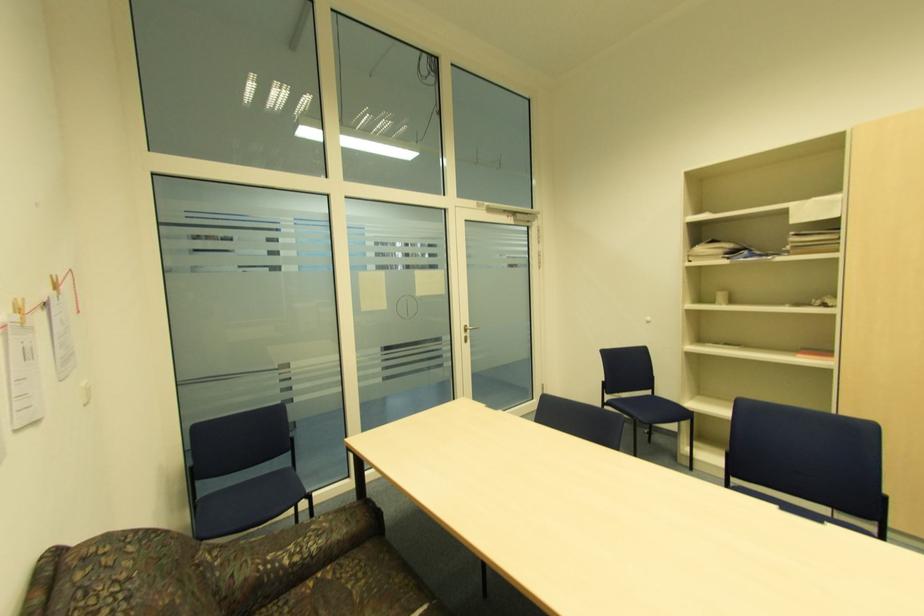
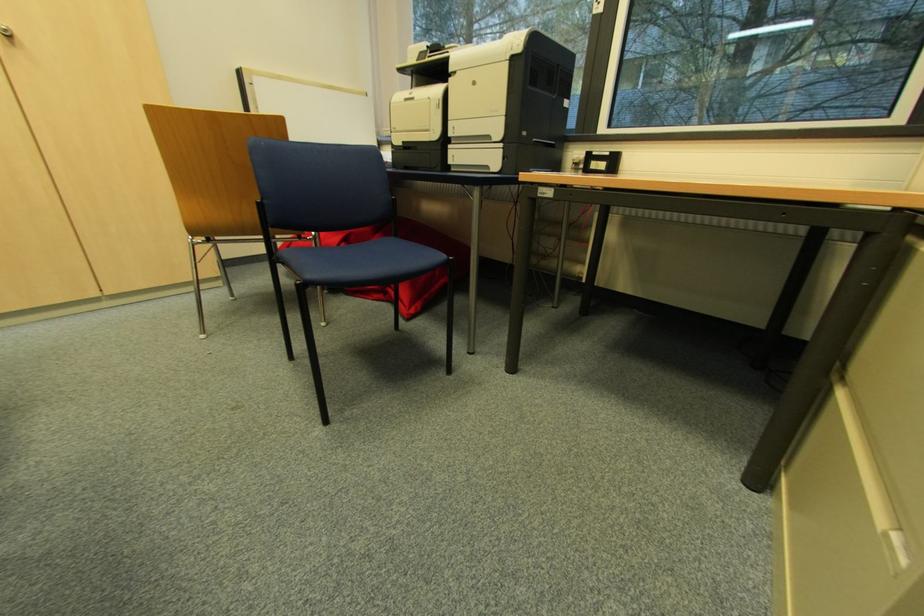
The first image is from the beginning of the video and the second image is from the end. How did the camera likely rotate when shooting the video?

The camera's rotation is toward right-down.